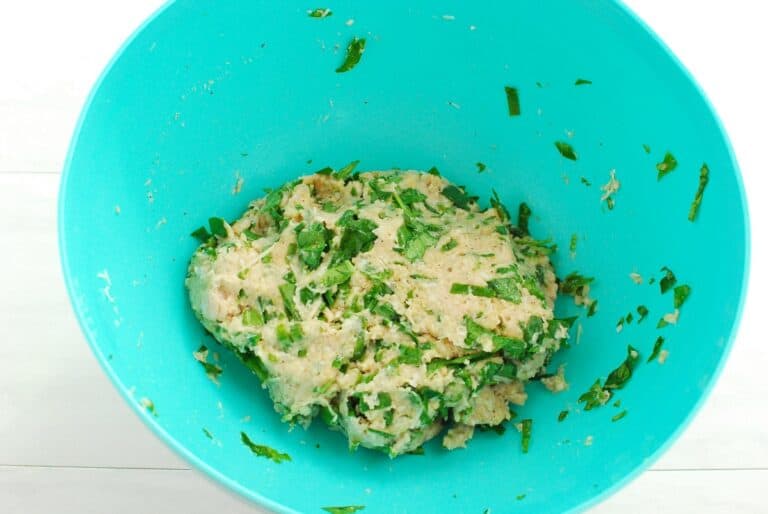
Locate an element on the screen. The height and width of the screenshot is (514, 768). table top is located at coordinates (65, 403).